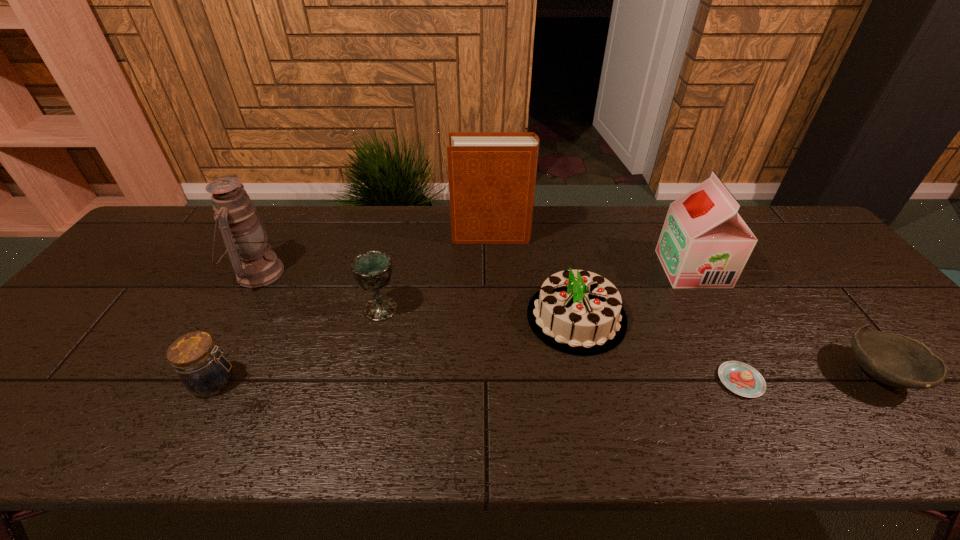
I want to click on vacant space that is in between the soya milk and the oil lamp, so click(475, 271).

I want to click on free space between the birthday cake and the soya milk, so click(x=635, y=293).

The width and height of the screenshot is (960, 540). Find the location of `free space between the jar and the birthday cake`. free space between the jar and the birthday cake is located at coordinates (396, 349).

Where is `vacant region between the oil lamp and the chalice`? This screenshot has height=540, width=960. vacant region between the oil lamp and the chalice is located at coordinates (320, 291).

I want to click on free space between the sixth tallest object and the soya milk, so click(x=454, y=325).

Identify which object is the fourth nearest to the rightmost object. Please provide its 2D coordinates. Your answer should be formatted as a tuple, i.e. [(x, y)], where the tuple contains the x and y coordinates of a point satisfying the conditions above.

[(492, 175)]

Image resolution: width=960 pixels, height=540 pixels. In order to click on object that is the seventh nearest to the bowl in this screenshot , I will do `click(245, 237)`.

Where is `blank area in the image that satisfies the following two spatial constraints: 1. on the back side of the bowl; 2. on the open cover of the hardback book`? blank area in the image that satisfies the following two spatial constraints: 1. on the back side of the bowl; 2. on the open cover of the hardback book is located at coordinates (767, 235).